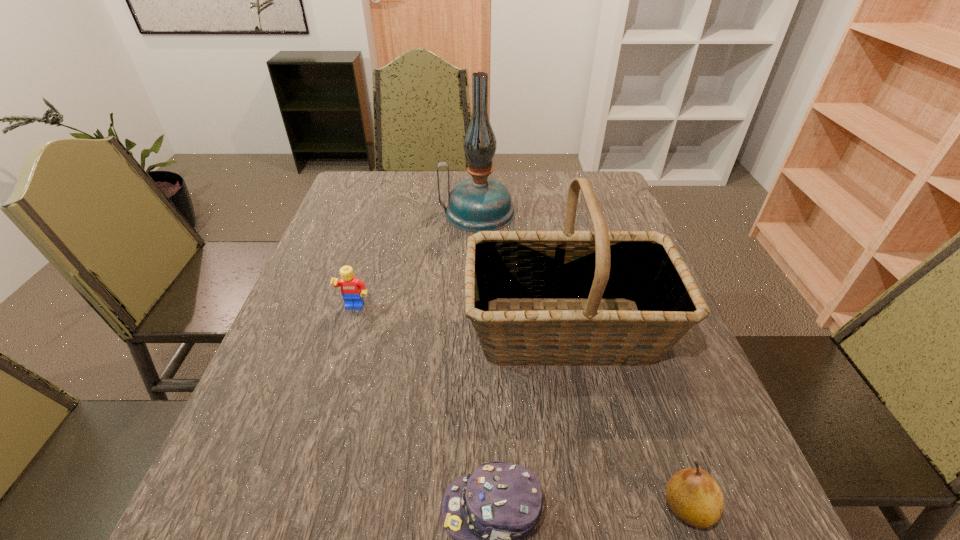
Image resolution: width=960 pixels, height=540 pixels. I want to click on oil lamp, so click(479, 203).

Locate an element on the screen. The width and height of the screenshot is (960, 540). the tallest object is located at coordinates (479, 203).

Find the location of a particular element. The width and height of the screenshot is (960, 540). basket is located at coordinates (641, 269).

I want to click on the leftmost object, so click(x=352, y=289).

I want to click on pear, so click(692, 495).

This screenshot has height=540, width=960. I want to click on free location located 0.140m on the front of the farthest object, so click(x=477, y=263).

I want to click on free spot located 0.280m by the handle of the basket, so click(x=342, y=329).

Find the location of a particular element. vacant space located by the handle of the basket is located at coordinates (426, 329).

Identify the location of free spot located 0.170m by the handle of the basket. The height and width of the screenshot is (540, 960). (391, 329).

This screenshot has width=960, height=540. In order to click on free space located on the face of the Lego in this screenshot , I will do `click(334, 377)`.